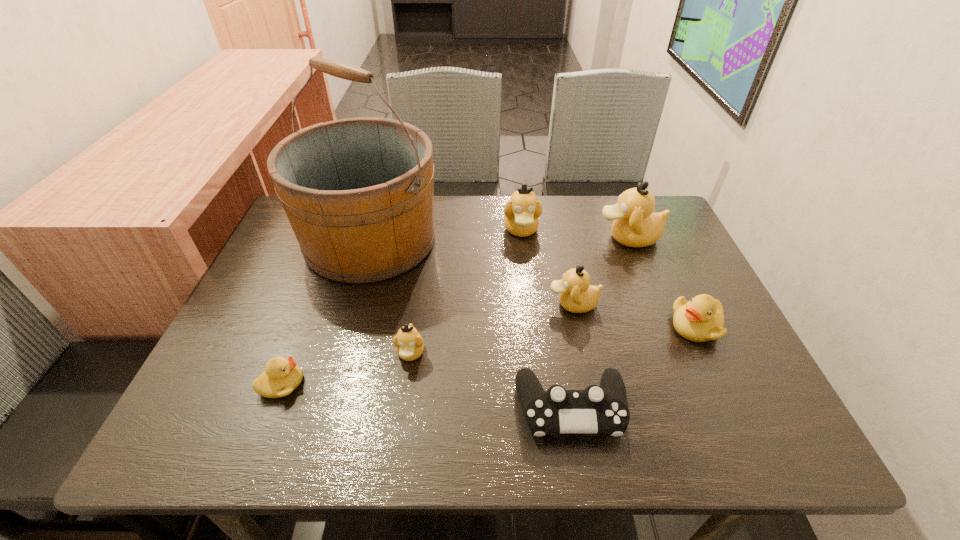
I want to click on vacant space located on the face of the third tallest duckling, so click(x=422, y=304).

This screenshot has height=540, width=960. I want to click on free location located on the face of the third tallest duckling, so click(485, 304).

You are a GUI agent. You are given a task and a screenshot of the screen. Output one action in this format:
    pyautogui.click(x=<x>, y=<y>)
    Task: Click on the vacant space located 0.400m on the beak of the right yellow duckling
    The image size is (960, 540).
    Given the screenshot: What is the action you would take?
    pyautogui.click(x=494, y=326)

Where is `free space located 0.260m on the beak of the right yellow duckling`? This screenshot has height=540, width=960. free space located 0.260m on the beak of the right yellow duckling is located at coordinates (557, 326).

At what (x,y) coordinates should I click in order to perform the action: click on free point located on the beak of the right yellow duckling. Please return your answer as a coordinate pair (x, y). The height and width of the screenshot is (540, 960). Looking at the image, I should click on (591, 326).

Locate an element on the screen. vacant space located on the face of the fifth duckling from right to left is located at coordinates (399, 434).

At what (x,y) coordinates should I click in order to perform the action: click on vacant position located 0.210m on the beak of the left yellow duckling. Please return your answer as a coordinate pair (x, y). Looking at the image, I should click on (407, 384).

At what (x,y) coordinates should I click in order to perform the action: click on bucket that is positioned at the far edge. Please return your answer as a coordinate pair (x, y). The width and height of the screenshot is (960, 540). Looking at the image, I should click on (358, 192).

Find the location of a particular element. The width and height of the screenshot is (960, 540). object at the near edge is located at coordinates (598, 409).

I want to click on bucket that is at the left edge, so click(358, 192).